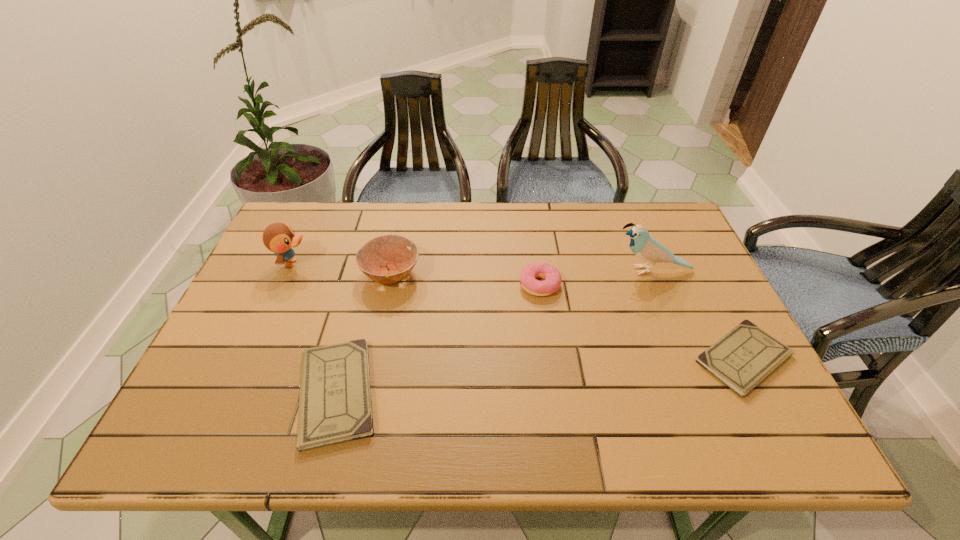
Image resolution: width=960 pixels, height=540 pixels. I want to click on vacant area in the image that satisfies the following two spatial constraints: 1. on the front-facing side of the right checkbook; 2. on the left side of the fifth shortest object, so click(x=250, y=359).

Find the location of a particular element. This screenshot has width=960, height=540. vacant position in the image that satisfies the following two spatial constraints: 1. on the front-facing side of the fifth shortest object; 2. on the right side of the shortest object is located at coordinates (250, 359).

Identify the location of vacant space that satisfies the following two spatial constraints: 1. at the face of the shortest object; 2. on the right side of the bird. Image resolution: width=960 pixels, height=540 pixels. (687, 359).

In order to click on free location that satisfies the following two spatial constraints: 1. on the back side of the bowl; 2. on the front-facing side of the leftmost object in this screenshot , I will do `click(393, 263)`.

Find the location of a particular element. vacant space that satisfies the following two spatial constraints: 1. on the back side of the right checkbook; 2. at the face of the bird is located at coordinates (698, 271).

The width and height of the screenshot is (960, 540). In order to click on blank space that satisfies the following two spatial constraints: 1. on the front-facing side of the taller checkbook; 2. on the left side of the leftmost object in this screenshot , I will do `click(233, 393)`.

This screenshot has height=540, width=960. What are the coordinates of `free space that satisfies the following two spatial constraints: 1. on the front-facing side of the second tallest object; 2. on the right side of the fourth shortest object` in the screenshot? It's located at (287, 274).

Find the location of a particular element. vacant point that satisfies the following two spatial constraints: 1. on the back side of the second shortest object; 2. on the right side of the third tallest object is located at coordinates (368, 274).